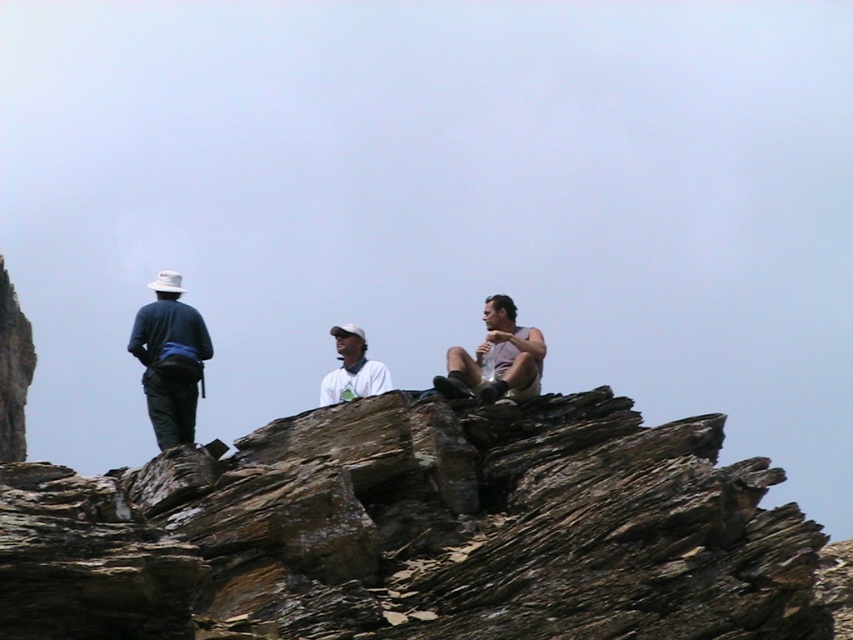
Question: Does matte blue shirt at left have a greater width compared to matte gray tank top at center?

Choices:
 (A) yes
 (B) no

Answer: (A)

Question: Does matte blue shirt at left have a smaller size compared to white matte shirt at center?

Choices:
 (A) yes
 (B) no

Answer: (B)

Question: Which object appears closest to the camera in this image?

Choices:
 (A) matte gray tank top at center
 (B) matte blue shirt at left
 (C) white matte shirt at center

Answer: (B)

Question: Estimate the real-world distances between objects in this image. Which object is farther from the matte gray tank top at center?

Choices:
 (A) white matte shirt at center
 (B) matte blue shirt at left

Answer: (A)

Question: Which of the following is the farthest from the observer?

Choices:
 (A) (532, 356)
 (B) (358, 380)

Answer: (B)

Question: Is matte gray tank top at center wider than white matte shirt at center?

Choices:
 (A) no
 (B) yes

Answer: (A)